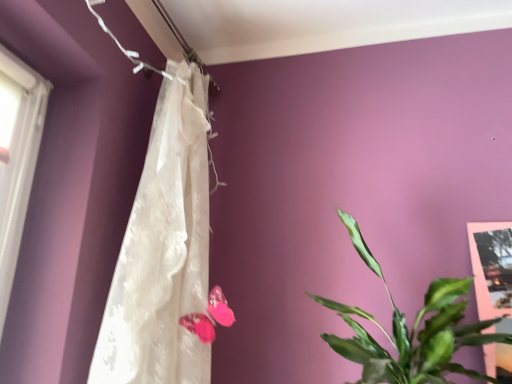
Question: Is pink fabric butterfly at center oriented away from green leafy plant at right?

Choices:
 (A) yes
 (B) no

Answer: (B)

Question: Is pink fabric butterfly at center wider than green leafy plant at right?

Choices:
 (A) no
 (B) yes

Answer: (A)

Question: Is pink fabric butterfly at center smaller than green leafy plant at right?

Choices:
 (A) yes
 (B) no

Answer: (A)

Question: Is pink fabric butterfly at center facing towards green leafy plant at right?

Choices:
 (A) yes
 (B) no

Answer: (B)

Question: Considering the relative sizes of pink fabric butterfly at center and green leafy plant at right in the image provided, is pink fabric butterfly at center taller than green leafy plant at right?

Choices:
 (A) no
 (B) yes

Answer: (A)

Question: Do you think pink fabric butterfly at center is within white lace curtain at upper center, or outside of it?

Choices:
 (A) outside
 (B) inside

Answer: (B)

Question: In terms of size, does pink fabric butterfly at center appear bigger or smaller than white lace curtain at upper center?

Choices:
 (A) big
 (B) small

Answer: (B)

Question: Is point (209, 291) closer or farther from the camera than point (159, 135)?

Choices:
 (A) closer
 (B) farther

Answer: (A)

Question: In the image, is pink fabric butterfly at center positioned in front of or behind white lace curtain at upper center?

Choices:
 (A) behind
 (B) front

Answer: (A)

Question: In terms of height, does green leafy plant at right look taller or shorter compared to pink fabric butterfly at center?

Choices:
 (A) short
 (B) tall

Answer: (B)

Question: Which is correct: green leafy plant at right is inside pink fabric butterfly at center, or outside of it?

Choices:
 (A) outside
 (B) inside

Answer: (A)

Question: Is point (402, 352) closer or farther from the camera than point (223, 304)?

Choices:
 (A) closer
 (B) farther

Answer: (A)

Question: Is green leafy plant at right wider or thinner than pink fabric butterfly at center?

Choices:
 (A) wide
 (B) thin

Answer: (A)

Question: Would you say white lace curtain at upper center is to the left or to the right of green leafy plant at right in the picture?

Choices:
 (A) left
 (B) right

Answer: (A)

Question: From the image's perspective, is white lace curtain at upper center positioned above or below green leafy plant at right?

Choices:
 (A) above
 (B) below

Answer: (A)